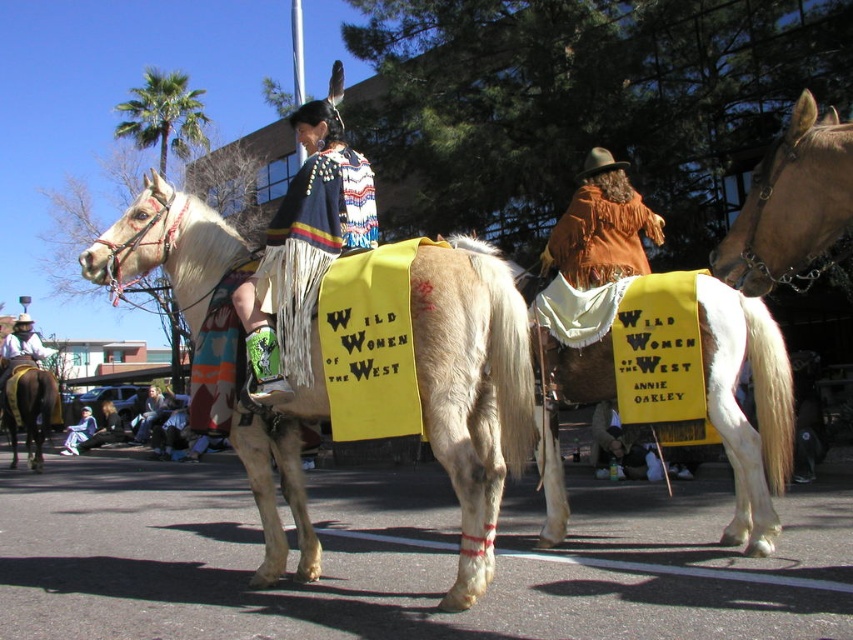
You are a costume designer preparing for a historical play. You need to ensure that the white leather saddle at center and the light brown leather jacket at center are proportionate to each other. Based on the scene description, which object is smaller in size?

The white leather saddle at center is smaller in size compared to the light brown leather jacket at center.

You are a photographer trying to capture the entire scene of the parade. You notice the white textured horse at center and the denim jacket at lower left. Which object is narrower in width when viewed from your position?

The white textured horse at center is narrower in width than the denim jacket at lower left.

You are a photographer at the parade. You need to capture a photo that includes both the white leather cowboy hat at left and the light brown leather jacket at center. Which object will occupy more horizontal space in the photo?

The white leather cowboy hat at left has a greater width than the light brown leather jacket at center, so it will occupy more horizontal space in the photo.